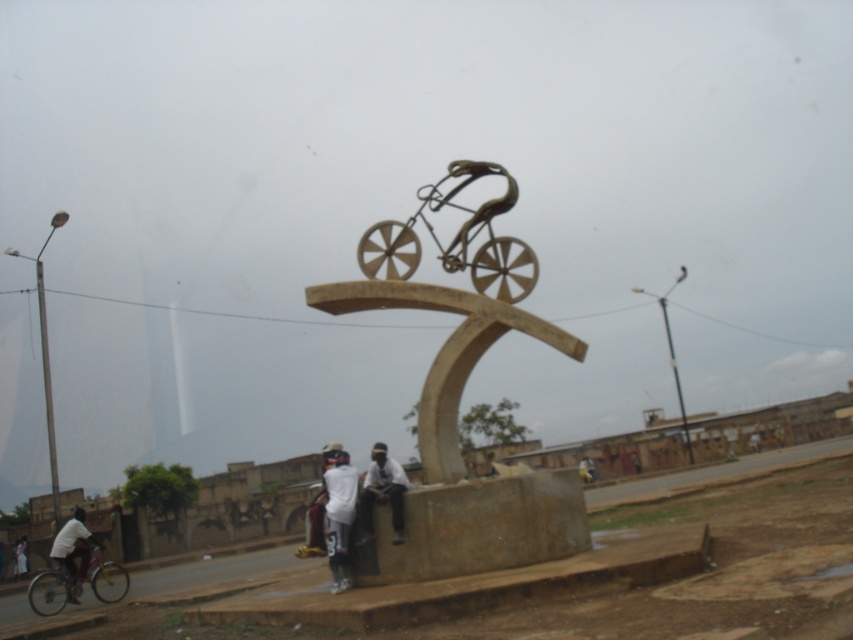
Which is more to the right, silver metallic bicycle at lower left or white matte shirt at lower center?

Positioned to the right is white matte shirt at lower center.

Between silver metallic bicycle at lower left and white matte shirt at lower center, which one is positioned lower?

Positioned lower is silver metallic bicycle at lower left.

Between point (107, 568) and point (370, 456), which one is positioned in front?

Point (370, 456) is in front.

The height and width of the screenshot is (640, 853). Find the location of `silver metallic bicycle at lower left`. silver metallic bicycle at lower left is located at coordinates (51, 589).

Is bronze bicycle at center shorter than white clothed cyclist at lower left?

No, bronze bicycle at center is not shorter than white clothed cyclist at lower left.

Is point (403, 534) positioned after point (73, 573)?

No, (403, 534) is in front of (73, 573).

Which is in front, point (492, 244) or point (61, 529)?

Point (492, 244)

At what (x,y) coordinates should I click in order to perform the action: click on bronze bicycle at center. Please return your answer as a coordinate pair (x, y). Looking at the image, I should click on (459, 397).

Between white matte shirt at lower center and white clothed cyclist at lower left, which one has more height?

white clothed cyclist at lower left

Who is shorter, white matte shirt at lower center or white clothed cyclist at lower left?

white matte shirt at lower center is shorter.

This screenshot has height=640, width=853. What are the coordinates of `white matte shirt at lower center` in the screenshot? It's located at (381, 492).